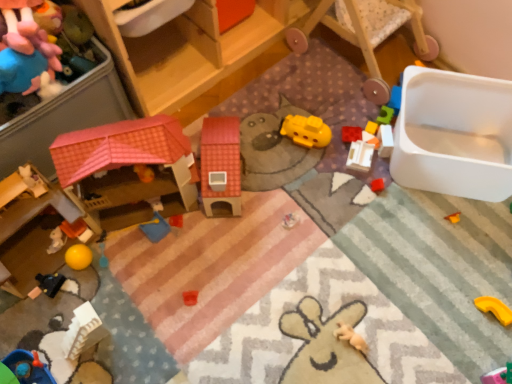
Locate an element on the screen. free space to the left of light brown plush toy at lower right, the sixth toy from the right is located at coordinates (289, 333).